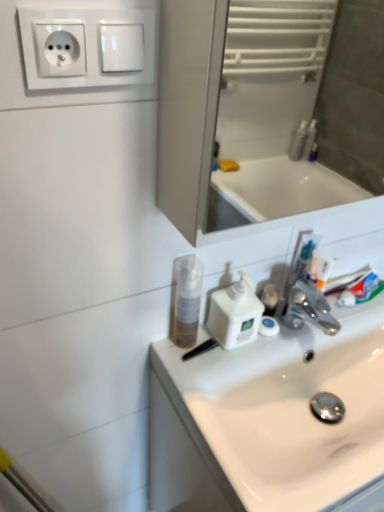
Question: Considering the relative sizes of white plastic socket at upper left and white plastic soap dispenser at center in the image provided, is white plastic socket at upper left thinner than white plastic soap dispenser at center?

Choices:
 (A) yes
 (B) no

Answer: (A)

Question: Is the position of white plastic socket at upper left less distant than that of white plastic soap dispenser at center?

Choices:
 (A) yes
 (B) no

Answer: (A)

Question: Can we say white plastic socket at upper left lies outside white plastic soap dispenser at center?

Choices:
 (A) yes
 (B) no

Answer: (A)

Question: From the image's perspective, is white plastic socket at upper left located above white plastic soap dispenser at center?

Choices:
 (A) yes
 (B) no

Answer: (A)

Question: Is white plastic socket at upper left wider than white plastic soap dispenser at center?

Choices:
 (A) no
 (B) yes

Answer: (A)

Question: Would you say white plastic socket at upper left is a long distance from white plastic soap dispenser at center?

Choices:
 (A) no
 (B) yes

Answer: (A)

Question: From a real-world perspective, is white glossy sink at center physically above translucent plastic mouthwash at sink?

Choices:
 (A) yes
 (B) no

Answer: (B)

Question: Is translucent plastic mouthwash at sink surrounded by white glossy sink at center?

Choices:
 (A) yes
 (B) no

Answer: (B)

Question: Considering the relative sizes of white glossy sink at center and translucent plastic mouthwash at sink in the image provided, is white glossy sink at center shorter than translucent plastic mouthwash at sink?

Choices:
 (A) yes
 (B) no

Answer: (A)

Question: From the image's perspective, would you say white glossy sink at center is shown under translucent plastic mouthwash at sink?

Choices:
 (A) no
 (B) yes

Answer: (B)

Question: Is white glossy sink at center aimed at translucent plastic mouthwash at sink?

Choices:
 (A) yes
 (B) no

Answer: (B)

Question: From a real-world perspective, is white glossy sink at center located beneath translucent plastic mouthwash at sink?

Choices:
 (A) no
 (B) yes

Answer: (B)

Question: Is white plastic socket at upper left shorter than translucent plastic mouthwash at sink?

Choices:
 (A) no
 (B) yes

Answer: (B)